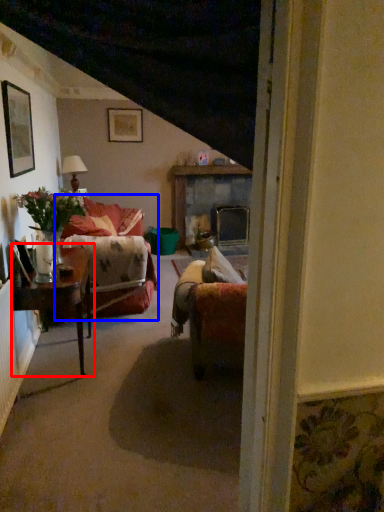
Question: Which of the following is the closest to the observer, table (highlighted by a red box) or couch (highlighted by a blue box)?

Choices:
 (A) table
 (B) couch

Answer: (A)